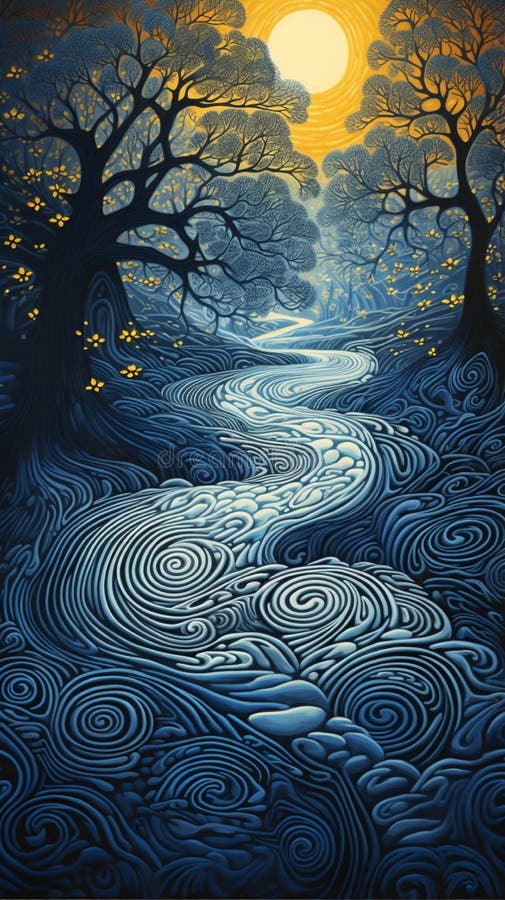
You are a GUI agent. You are given a task and a screenshot of the screen. Output one action in this format:
    pyautogui.click(x=<x>, y=<y>)
    Task: Click on the abstract painting
    The image size is (505, 900).
    Given the screenshot: What is the action you would take?
    pyautogui.click(x=216, y=363)